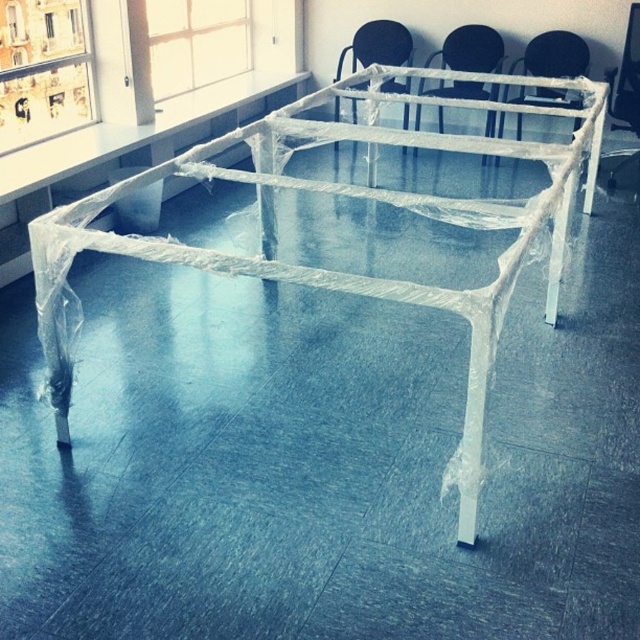
You are a maintenance worker who needs to clean the transparent plastic bed frame at center and the clear plastic chair at upper center. Which object should you clean first if you want to start with the one nearest to you?

You should clean the transparent plastic bed frame at center first because it is closer to you than the clear plastic chair at upper center.

You are standing at the entrance of the room and want to sit down. There is a transparent plastic chair at upper center. Where should you walk to reach it?

The transparent plastic chair at upper center is located at coordinates approximately 0.087 on the x axis and 0.867 on the y axis, so walk towards those coordinates to reach it.

You are a delivery person who needs to place a box between the clear plastic chair at upper center and the clear plastic chair at center. The box is 20 inches long. Can you fit the box between them without moving the chairs?

The clear plastic chair at upper center and the clear plastic chair at center are 19.62 inches apart from each other. Since the box is 20 inches long, it cannot fit between them without moving the chairs.